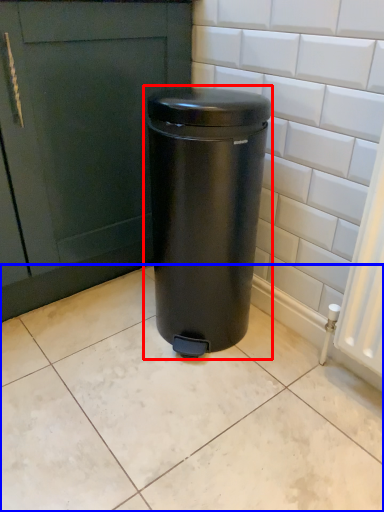
Question: Which point is further to the camera, waste container (highlighted by a red box) or ceramic tile (highlighted by a blue box)?

Choices:
 (A) waste container
 (B) ceramic tile

Answer: (A)